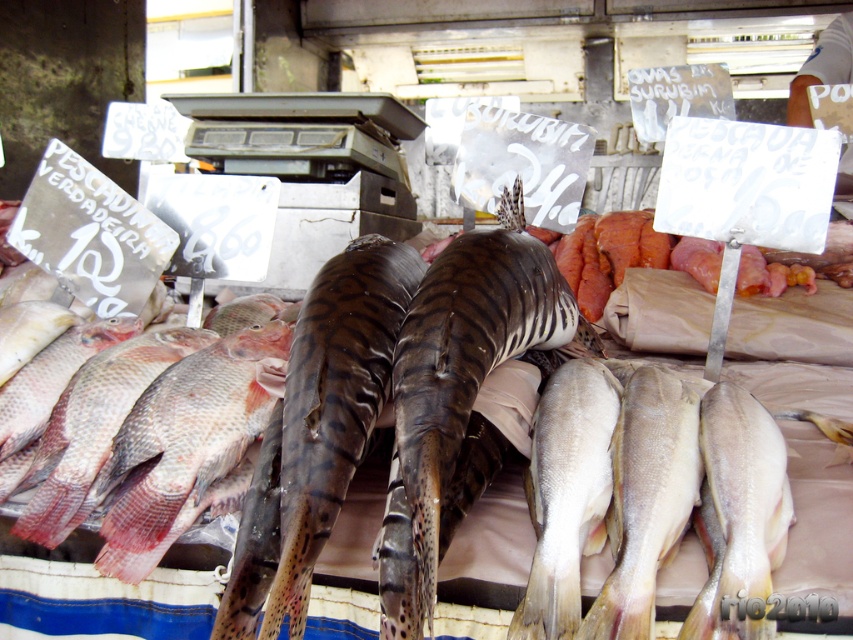
Question: Estimate the real-world distances between objects in this image. Which object is closer to the yellowish matte fish at lower right?

Choices:
 (A) shiny brown shark at center
 (B) pinkish matte fish at lower left
 (C) pale yellowish-white flesh at center

Answer: (C)

Question: Among these objects, which one is farthest from the camera?

Choices:
 (A) dark brown spotted shark at center
 (B) pinkish matte fish at left

Answer: (B)

Question: Can you confirm if white smooth fish at center is thinner than pinkish matte fish at lower left?

Choices:
 (A) yes
 (B) no

Answer: (B)

Question: Which object is closer to the camera taking this photo?

Choices:
 (A) pinkish matte fish at left
 (B) pale yellowish-white flesh at center
 (C) white smooth fish at center
 (D) pinkish matte fish at lower left

Answer: (B)

Question: Can you confirm if shiny brown shark at center is thinner than pinkish matte fish at left?

Choices:
 (A) no
 (B) yes

Answer: (B)

Question: Does dark brown spotted shark at center appear on the left side of shiny brown shark at center?

Choices:
 (A) no
 (B) yes

Answer: (A)